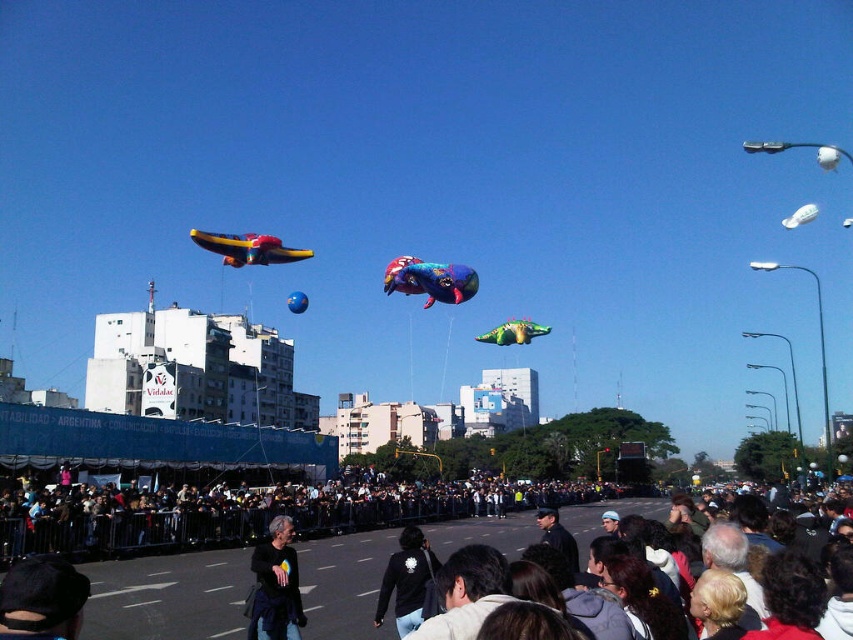
Question: Among these objects, which one is farthest from the camera?

Choices:
 (A) dark brown hair at center
 (B) shiny metallic kite at center
 (C) black matte jacket at lower center

Answer: (B)

Question: Considering the real-world distances, which object is farthest from the black matte jacket at lower center?

Choices:
 (A) dark gray crowd at lower center
 (B) green matte balloon at center

Answer: (B)

Question: Which object is farther from the camera taking this photo?

Choices:
 (A) shiny metallic airplane at upper left
 (B) dark brown hair at center

Answer: (A)

Question: Is dark brown hair at center smaller than shiny metallic airplane at upper left?

Choices:
 (A) yes
 (B) no

Answer: (A)

Question: Observing the image, what is the correct spatial positioning of dark gray crowd at lower center in reference to black matte shirt at center?

Choices:
 (A) below
 (B) above

Answer: (A)

Question: Can you confirm if shiny metallic kite at center is positioned to the right of green matte balloon at center?

Choices:
 (A) yes
 (B) no

Answer: (B)